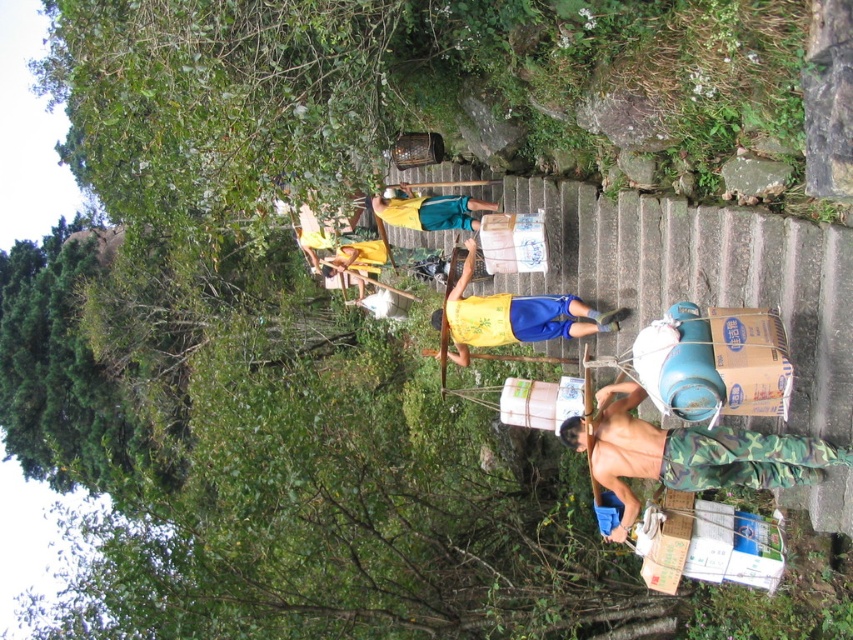
Can you confirm if yellow matte shirt at center is shorter than yellow fabric shirt at center?

No, yellow matte shirt at center is not shorter than yellow fabric shirt at center.

Does yellow matte shirt at center appear under yellow fabric shirt at center?

Yes.

Who is more distant from viewer, (x=587, y=333) or (x=397, y=189)?

Point (x=397, y=189)

Where is `yellow matte shirt at center`? yellow matte shirt at center is located at coordinates (514, 316).

Between camouflage pants at lower right and yellow fabric shirt at center, which one has less height?

With less height is yellow fabric shirt at center.

From the picture: Is camouflage pants at lower right closer to the viewer compared to yellow fabric shirt at center?

Yes.

Who is more distant from viewer, (672, 481) or (384, 198)?

Positioned behind is point (384, 198).

Locate an element on the screen. The height and width of the screenshot is (640, 853). camouflage pants at lower right is located at coordinates tap(695, 454).

Looking at this image, does yellow matte shirt at center have a lesser width compared to yellow fabric shirt at upper center?

No.

Where is `yellow matte shirt at center`? yellow matte shirt at center is located at coordinates (514, 316).

What are the coordinates of `yellow matte shirt at center` in the screenshot? It's located at (514, 316).